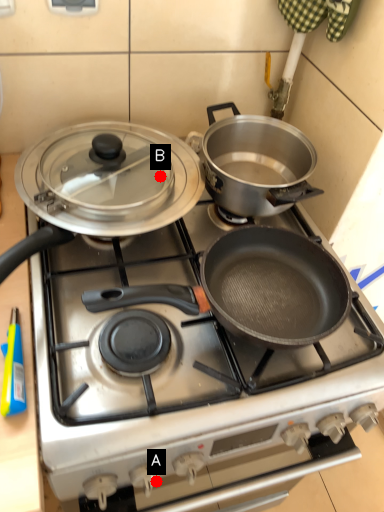
Question: Two points are circled on the image, labeled by A and B beside each circle. Which of the following is the closest to the observer?

Choices:
 (A) A is closer
 (B) B is closer

Answer: (A)